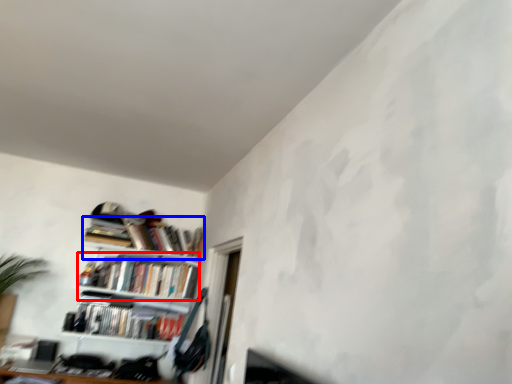
Question: Among these objects, which one is nearest to the camera, book (highlighted by a red box) or book (highlighted by a blue box)?

Choices:
 (A) book
 (B) book

Answer: (A)